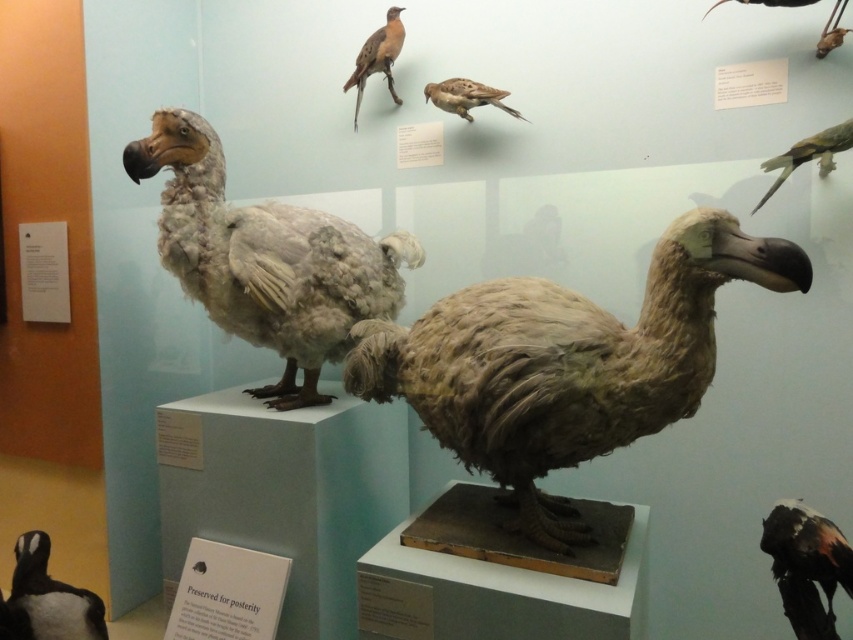
Question: Based on their relative distances, which object is farther from the black glossy bird at lower right?

Choices:
 (A) smooth brown beak at upper right
 (B) brown fuzzy dodo at center

Answer: (A)

Question: Is black matte penguin at lower left in front of brown speckled feathers at upper center?

Choices:
 (A) yes
 (B) no

Answer: (A)

Question: Among these points, which one is farthest from the camera?

Choices:
 (A) (462, 109)
 (B) (811, 3)

Answer: (A)

Question: In this image, where is brown fuzzy dodo at center located relative to black matte penguin at lower left?

Choices:
 (A) right
 (B) left

Answer: (A)

Question: Which of these objects is positioned farthest from the brown matte bird at upper center?

Choices:
 (A) brown speckled feathers at upper center
 (B) black matte penguin at lower left

Answer: (B)

Question: Does brown fuzzy dodo at center come behind smooth brown beak at upper right?

Choices:
 (A) yes
 (B) no

Answer: (B)